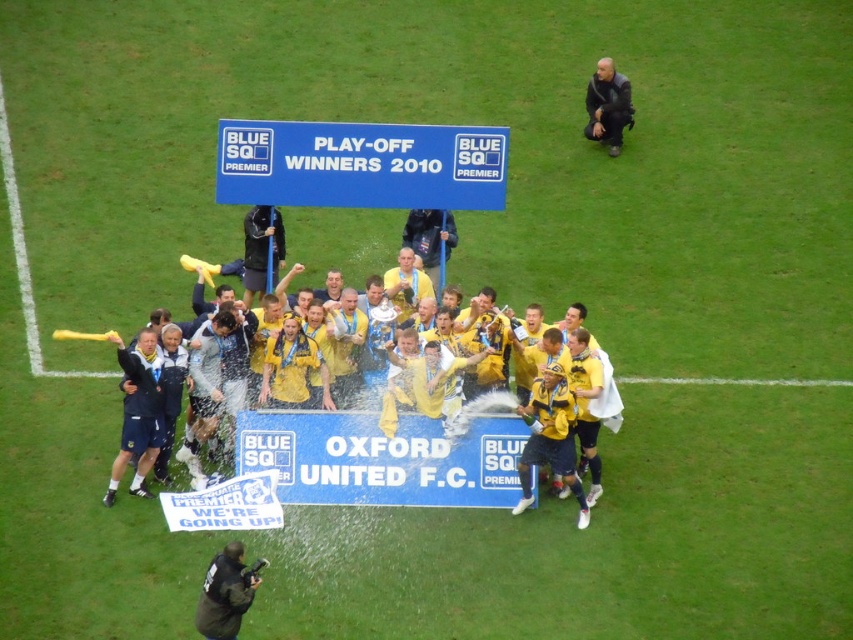
You are a photographer at the event and want to capture a photo that includes both the yellow jersey at center and the black fabric referee at upper right. Based on their positions, where should you position the camera to ensure both subjects are in frame?

Since the yellow jersey at center is to the left of the black fabric referee at upper right, you should position the camera so that it faces towards the center of the image, ensuring both the left and right positions are captured within the frame.

You are a photographer standing on the football pitch capturing the celebration. You notice the dark green jacket at lower center and the black fabric referee at upper right. Which object is nearer to you?

The dark green jacket at lower center is closer to the viewer than the black fabric referee at upper right.